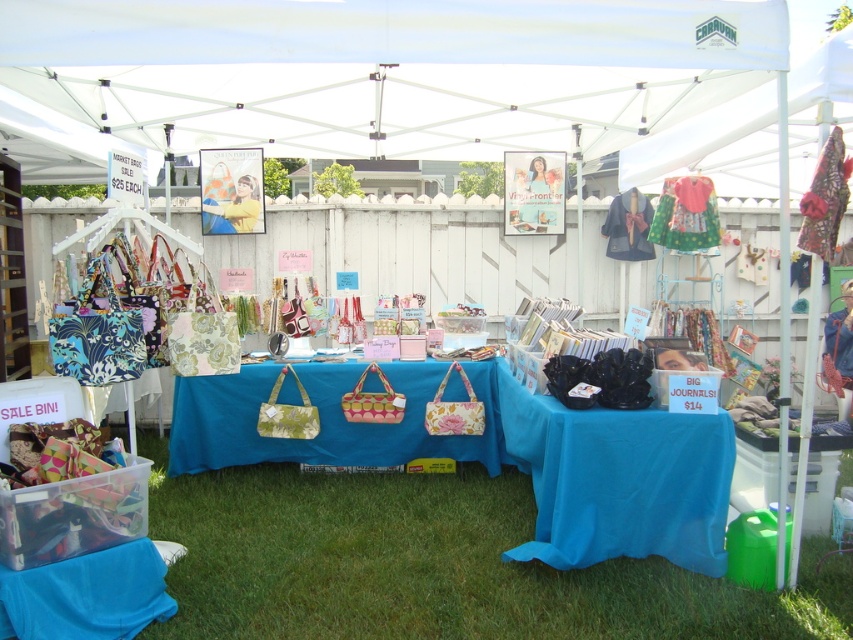
You are a customer at the outdoor market stall under the CARAVAN canopy. You see the green grass at lower center and the blue fabric table at center. Which object is closer to you as you face the stall?

The green grass at lower center is closer to you because it is in front of the blue fabric table at center.